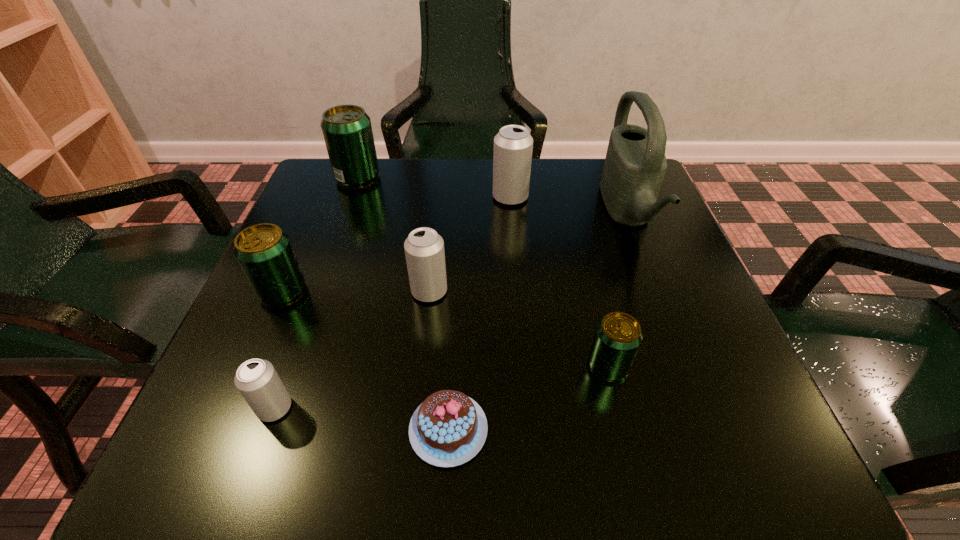
Locate an element on the screen. the nearest white beer can is located at coordinates (256, 379).

Find the location of a particular element. the smallest white beer can is located at coordinates (256, 379).

This screenshot has width=960, height=540. I want to click on chocolate cake, so click(x=449, y=428).

This screenshot has width=960, height=540. I want to click on the shortest object, so click(449, 428).

The height and width of the screenshot is (540, 960). Find the location of `free spot located on the spout of the watering can`. free spot located on the spout of the watering can is located at coordinates (525, 213).

This screenshot has width=960, height=540. Identify the location of free point located on the spout of the watering can. (583, 213).

At what (x,y) coordinates should I click in order to perform the action: click on vacant space located on the spout of the watering can. Please return your answer as a coordinate pair (x, y). Looking at the image, I should click on (441, 213).

The width and height of the screenshot is (960, 540). I want to click on free spot located 0.170m on the front of the farthest green beer can, so click(x=337, y=235).

At what (x,y) coordinates should I click in order to perform the action: click on free space located on the right of the rightmost white beer can. Please return your answer as a coordinate pair (x, y). The height and width of the screenshot is (540, 960). Looking at the image, I should click on (648, 197).

Find the location of a particular element. This screenshot has height=540, width=960. vacant position located 0.270m on the back of the second farthest white beer can is located at coordinates (440, 197).